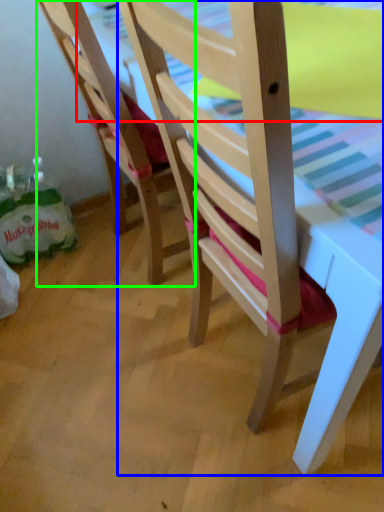
Question: Considering the real-world distances, which object is closest to table top (highlighted by a red box)? chair (highlighted by a blue box) or chair (highlighted by a green box).

Choices:
 (A) chair
 (B) chair

Answer: (B)